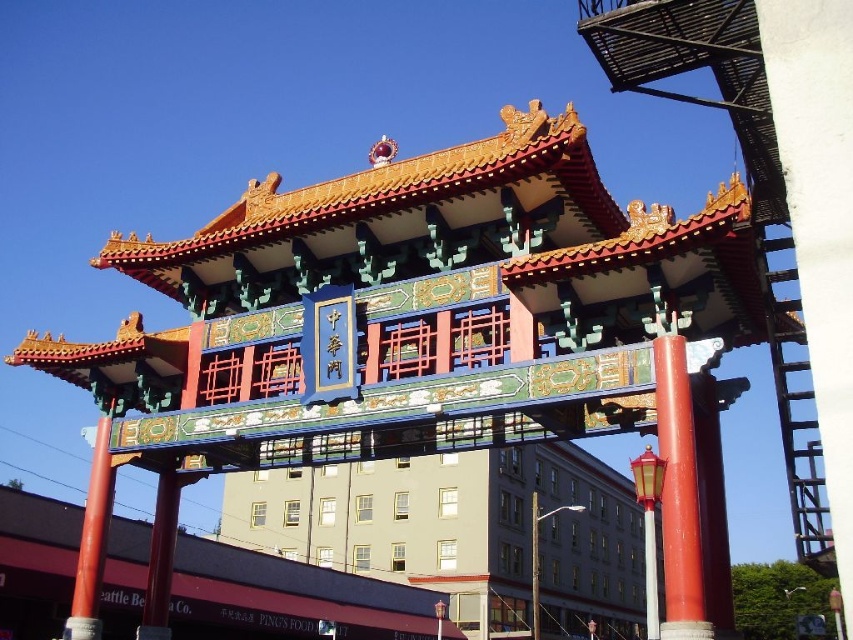
You are standing in front of the Gate of Harmonious Interest in Chinatown. You see a point marked at coordinates (x=677, y=496). What object is located at this point?

The point at coordinates (x=677, y=496) indicates a smooth glossy red pillar at center.

You are standing in front of the Gate of Harmonious Interest and want to take a photo that includes both the smooth glossy red pillar at center and the smooth red pole at left. Which object should you position closer to the left side of the frame?

The smooth red pole at left should be positioned closer to the left side of the frame since it is located to the left of the smooth glossy red pillar at center.